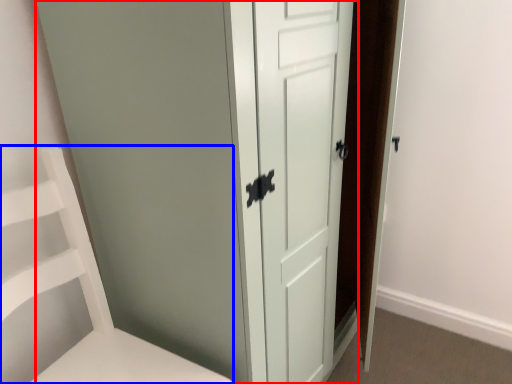
Question: Which object appears closest to the camera in this image, door (highlighted by a red box) or furniture (highlighted by a blue box)?

Choices:
 (A) door
 (B) furniture

Answer: (B)